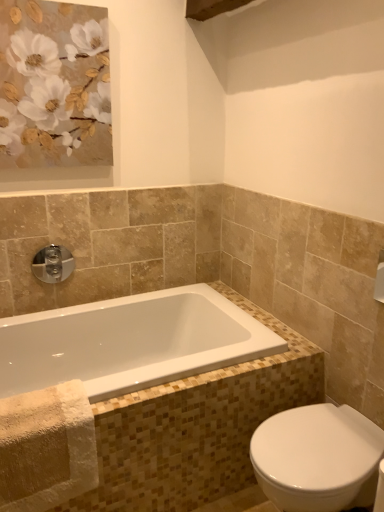
Question: Can you confirm if chrome/metallic faucet at upper left is thinner than white glossy bidet at lower right?

Choices:
 (A) no
 (B) yes

Answer: (B)

Question: Could white glossy bidet at lower right be considered to be inside chrome/metallic faucet at upper left?

Choices:
 (A) yes
 (B) no

Answer: (B)

Question: Is chrome/metallic faucet at upper left at the right side of white glossy bidet at lower right?

Choices:
 (A) no
 (B) yes

Answer: (A)

Question: Are chrome/metallic faucet at upper left and white glossy bidet at lower right located far from each other?

Choices:
 (A) no
 (B) yes

Answer: (B)

Question: Is chrome/metallic faucet at upper left bigger than white glossy bidet at lower right?

Choices:
 (A) yes
 (B) no

Answer: (B)

Question: From a real-world perspective, is chrome/metallic faucet at upper left above or below matte gold flowers at upper left?

Choices:
 (A) below
 (B) above

Answer: (A)

Question: Considering the positions of point (x=44, y=248) and point (x=6, y=23), is point (x=44, y=248) closer or farther from the camera than point (x=6, y=23)?

Choices:
 (A) farther
 (B) closer

Answer: (A)

Question: Would you say chrome/metallic faucet at upper left is to the left or to the right of matte gold flowers at upper left in the picture?

Choices:
 (A) right
 (B) left

Answer: (B)

Question: From the image's perspective, is chrome/metallic faucet at upper left located above or below matte gold flowers at upper left?

Choices:
 (A) below
 (B) above

Answer: (A)

Question: In the image, is chrome/metallic faucet at upper left positioned in front of or behind white glossy bathtub at lower left?

Choices:
 (A) behind
 (B) front

Answer: (A)

Question: Is chrome/metallic faucet at upper left wider or thinner than white glossy bathtub at lower left?

Choices:
 (A) thin
 (B) wide

Answer: (A)

Question: Considering the positions of chrome/metallic faucet at upper left and white glossy bathtub at lower left in the image, is chrome/metallic faucet at upper left taller or shorter than white glossy bathtub at lower left?

Choices:
 (A) short
 (B) tall

Answer: (B)

Question: Is point (38, 262) positioned closer to the camera than point (26, 338)?

Choices:
 (A) farther
 (B) closer

Answer: (A)

Question: Considering their positions, is white glossy bathtub at lower left located in front of or behind chrome/metallic faucet at upper left?

Choices:
 (A) front
 (B) behind

Answer: (A)

Question: From the image's perspective, relative to chrome/metallic faucet at upper left, is white glossy bathtub at lower left above or below?

Choices:
 (A) below
 (B) above

Answer: (A)